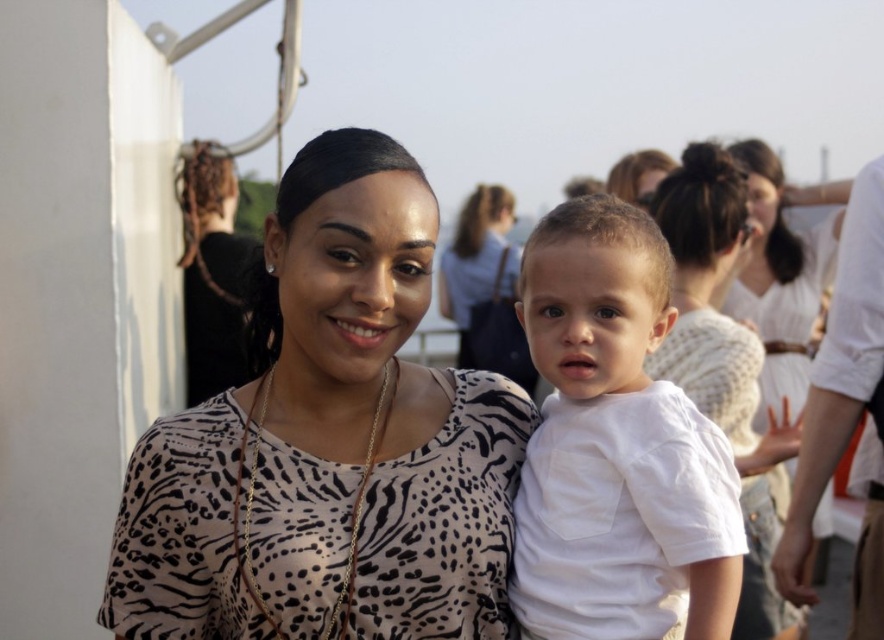
Question: Can you confirm if white cotton shirt at center is positioned above white matte shirt at center?

Choices:
 (A) no
 (B) yes

Answer: (A)

Question: Which of the following is the farthest from the observer?

Choices:
 (A) white matte shirt at center
 (B) white cotton shirt at center
 (C) leopard print blouse at center

Answer: (A)

Question: Can you confirm if white cotton shirt at center is bigger than matte black shirt at center?

Choices:
 (A) no
 (B) yes

Answer: (B)

Question: Is the position of leopard print blouse at center less distant than that of white cotton shirt at center?

Choices:
 (A) no
 (B) yes

Answer: (A)

Question: Which object is farther from the camera taking this photo?

Choices:
 (A) white matte shirt at center
 (B) matte black shirt at center
 (C) leopard print blouse at center

Answer: (B)

Question: Which point appears farthest from the camera in this image?

Choices:
 (A) 349,624
 (B) 691,253

Answer: (B)